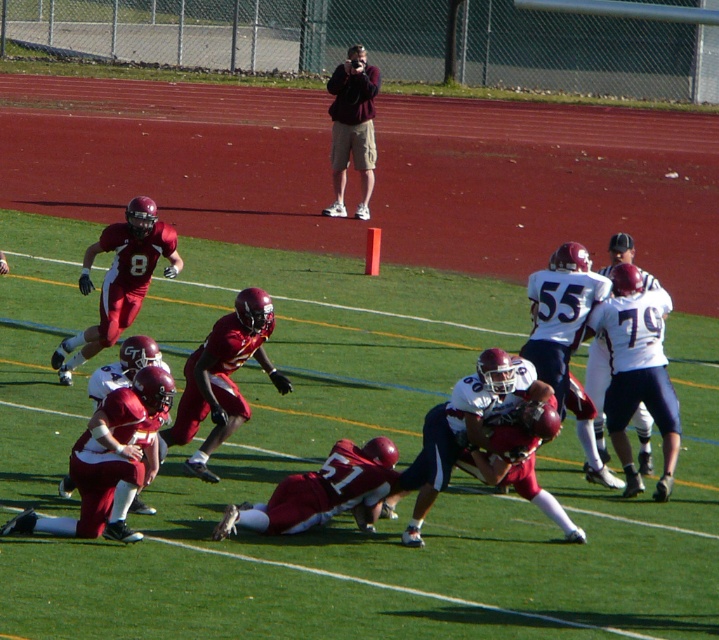
Question: Which point is closer to the camera?

Choices:
 (A) (385, 467)
 (B) (487, 490)

Answer: (A)

Question: Is maroon fabric jacket at upper center wider than white matte jersey at center-right?

Choices:
 (A) yes
 (B) no

Answer: (A)

Question: Which object is the farthest from the shiny maroon football player at center?

Choices:
 (A) white matte jersey at center-right
 (B) maroon fabric jacket at upper center
 (C) shiny red football player at left
 (D) maroon fabric football player at center

Answer: (B)

Question: Does shiny maroon football player at center have a smaller size compared to shiny red football player at left?

Choices:
 (A) yes
 (B) no

Answer: (A)

Question: Which object is the closest to the shiny red football players at center?

Choices:
 (A) maroon fabric football player at center
 (B) shiny maroon football player at center
 (C) shiny red football player at left

Answer: (A)

Question: Observing the image, what is the correct spatial positioning of shiny red football players at center in reference to maroon fabric football player at center?

Choices:
 (A) above
 (B) below

Answer: (A)